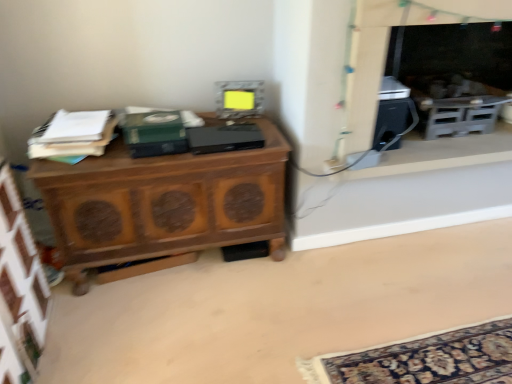
Question: Is black plastic speaker at right surrounding matte gray microwave at center?

Choices:
 (A) no
 (B) yes

Answer: (A)

Question: Does black plastic speaker at right appear on the left side of matte gray microwave at center?

Choices:
 (A) yes
 (B) no

Answer: (B)

Question: From the image's perspective, is black plastic speaker at right below matte gray microwave at center?

Choices:
 (A) yes
 (B) no

Answer: (A)

Question: Is black plastic speaker at right thinner than matte gray microwave at center?

Choices:
 (A) no
 (B) yes

Answer: (A)

Question: Is black plastic speaker at right not inside matte gray microwave at center?

Choices:
 (A) no
 (B) yes

Answer: (B)

Question: Which is correct: white paper stack at left, the 2th book positioned from the right, is inside wooden cabinet at lower left, or outside of it?

Choices:
 (A) inside
 (B) outside

Answer: (B)

Question: Considering the positions of point (60, 147) and point (444, 314), is point (60, 147) closer or farther from the camera than point (444, 314)?

Choices:
 (A) closer
 (B) farther

Answer: (A)

Question: From the image's perspective, relative to wooden cabinet at lower left, is white paper stack at left, the 2th book positioned from the right, above or below?

Choices:
 (A) below
 (B) above

Answer: (B)

Question: Considering the positions of white paper stack at left, which appears as the first book when viewed from the left, and wooden cabinet at lower left in the image, is white paper stack at left, which appears as the first book when viewed from the left, taller or shorter than wooden cabinet at lower left?

Choices:
 (A) short
 (B) tall

Answer: (B)

Question: Considering the positions of black plastic speaker at right and green matte book at center, the first book in the right-to-left sequence, in the image, is black plastic speaker at right taller or shorter than green matte book at center, the first book in the right-to-left sequence,?

Choices:
 (A) short
 (B) tall

Answer: (A)

Question: In terms of size, does black plastic speaker at right appear bigger or smaller than green matte book at center, the first book in the right-to-left sequence?

Choices:
 (A) small
 (B) big

Answer: (B)

Question: Considering the relative positions of black plastic speaker at right and green matte book at center, the first book in the right-to-left sequence, in the image provided, is black plastic speaker at right to the left or to the right of green matte book at center, the first book in the right-to-left sequence,?

Choices:
 (A) right
 (B) left

Answer: (A)

Question: From a real-world perspective, is black plastic speaker at right above or below green matte book at center, the first book in the right-to-left sequence?

Choices:
 (A) above
 (B) below

Answer: (B)

Question: Is black plastic speaker at right bigger or smaller than matte black fireplace at upper right, the first fireplace from the front?

Choices:
 (A) big
 (B) small

Answer: (B)

Question: Relative to matte black fireplace at upper right, the second fireplace from the back, is black plastic speaker at right in front or behind?

Choices:
 (A) behind
 (B) front

Answer: (A)